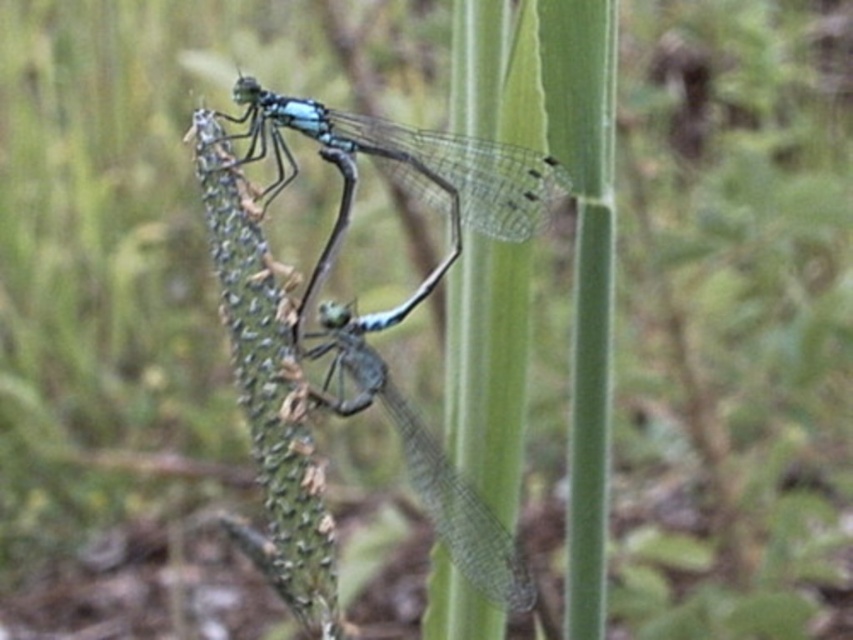
You are a researcher studying dragonflies. You have a measuring tool that can measure up to 8 centimeters. You need to determine the distance between the two dragonflies in the image. Can your tool measure the distance between the translucent blue dragonfly at center and the transparent blue dragonfly at center?

The distance between the translucent blue dragonfly at center and the transparent blue dragonfly at center is 7.97 centimeters, which is just under 8 centimeters. Therefore, your measuring tool can accurately measure the distance between them.

Looking at this image, you are a nature photographer aiming to capture the translucent blue dragonfly at center and the transparent blue dragonfly at center in a single shot. Which dragonfly will appear larger in your photo?

The translucent blue dragonfly at center will appear larger in your photo because it is closer to the viewer than the transparent blue dragonfly at center.